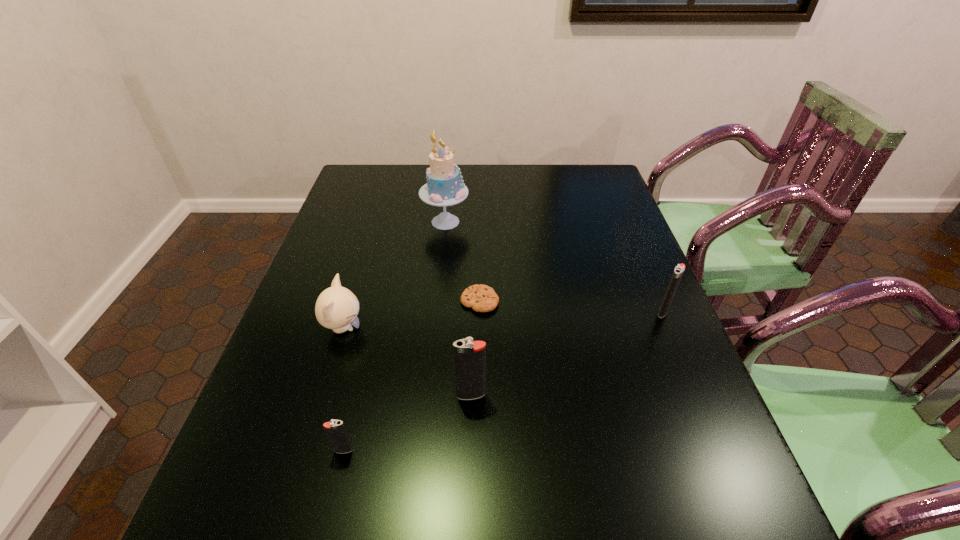
This screenshot has height=540, width=960. I want to click on free space between the cookie and the rightmost igniter, so click(x=571, y=306).

Where is `vacant area that lies between the shortest object and the cake`? vacant area that lies between the shortest object and the cake is located at coordinates (463, 261).

You are a GUI agent. You are given a task and a screenshot of the screen. Output one action in this format:
    pyautogui.click(x=<x>, y=<y>)
    Task: Click on the blank region between the shortest igniter and the cake
    Image resolution: width=960 pixels, height=540 pixels.
    Given the screenshot: What is the action you would take?
    pyautogui.click(x=395, y=336)

Locate an element on the screen. The width and height of the screenshot is (960, 540). free space that is in between the second igniter from right to left and the fifth tallest object is located at coordinates (407, 423).

You are a GUI agent. You are given a task and a screenshot of the screen. Output one action in this format:
    pyautogui.click(x=<x>, y=<y>)
    Task: Click on the vacant point located between the second nearest igniter and the fifth tallest object
    
    Given the screenshot: What is the action you would take?
    pyautogui.click(x=407, y=423)

You are a GUI agent. You are given a task and a screenshot of the screen. Output one action in this format:
    pyautogui.click(x=<x>, y=<y>)
    Task: Click on the vacant region between the nearest igniter and the shortest object
    The image size is (960, 540).
    Given the screenshot: What is the action you would take?
    pyautogui.click(x=412, y=376)

Choose which object is the second nearest neighbor to the second nearest object. Please provide its 2D coordinates. Your answer should be formatted as a tuple, i.e. [(x, y)], where the tuple contains the x and y coordinates of a point satisfying the conditions above.

[(481, 298)]

I want to click on object that is the second closest one to the cookie, so click(x=445, y=187).

Locate which igniter ranks in proximity to the cookie. Please provide its 2D coordinates. Your answer should be formatted as a tuple, i.e. [(x, y)], where the tuple contains the x and y coordinates of a point satisfying the conditions above.

[(469, 356)]

Identify which igniter is located as the nearest to the kitten. Please provide its 2D coordinates. Your answer should be formatted as a tuple, i.e. [(x, y)], where the tuple contains the x and y coordinates of a point satisfying the conditions above.

[(336, 432)]